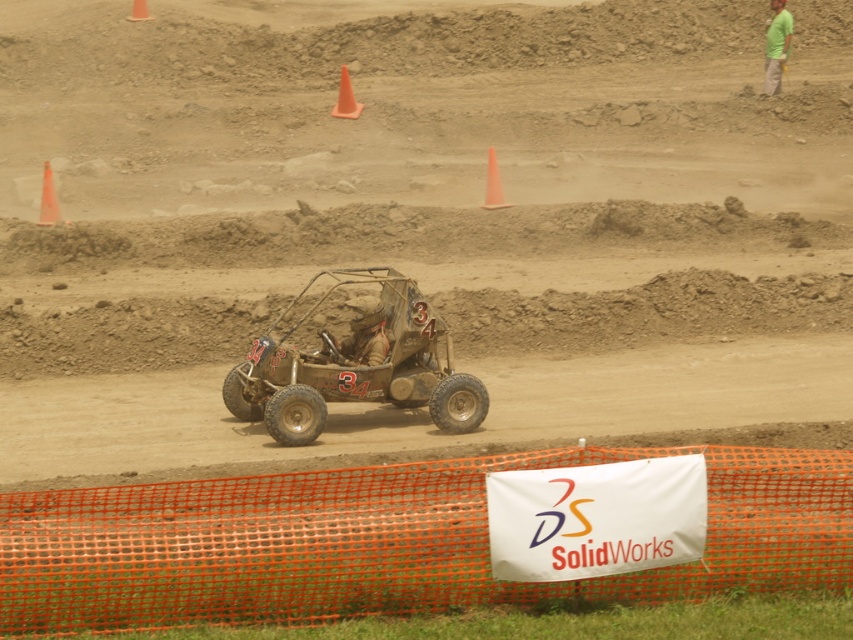
Question: Does orange mesh fence at lower center appear under orange plastic cone at center?

Choices:
 (A) no
 (B) yes

Answer: (B)

Question: Which of the following is the farthest from the observer?

Choices:
 (A) camouflage fabric helmet at center
 (B) orange plastic cone at left
 (C) rusty metal buggy at center

Answer: (B)

Question: Does rusty metal buggy at center have a larger size compared to green cotton shirt at upper right?

Choices:
 (A) no
 (B) yes

Answer: (B)

Question: Can you confirm if orange plastic cone at left is wider than orange plastic cone at center?

Choices:
 (A) yes
 (B) no

Answer: (B)

Question: Considering the real-world distances, which object is closest to the camouflage fabric helmet at center?

Choices:
 (A) orange matte cone at upper center
 (B) rusty metal buggy at center

Answer: (B)

Question: Which point is farther from the camera taking this photo?

Choices:
 (A) (506, 204)
 (B) (810, 483)

Answer: (A)